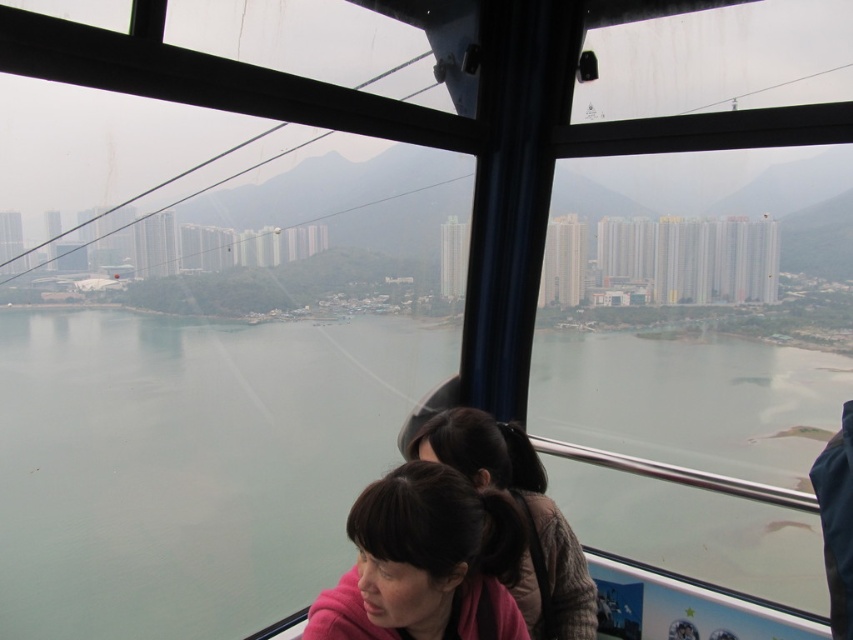
Question: Does pink fabric at lower center appear under pink fabric at center?

Choices:
 (A) yes
 (B) no

Answer: (B)

Question: Which point appears closest to the camera in this image?

Choices:
 (A) [491, 554]
 (B) [538, 627]

Answer: (A)

Question: Which point is farther from the camera taking this photo?

Choices:
 (A) (590, 589)
 (B) (440, 500)

Answer: (A)

Question: Can you confirm if pink fabric at lower center is thinner than pink fabric at center?

Choices:
 (A) no
 (B) yes

Answer: (B)

Question: Can you confirm if pink fabric at lower center is positioned to the right of pink fabric at center?

Choices:
 (A) yes
 (B) no

Answer: (B)